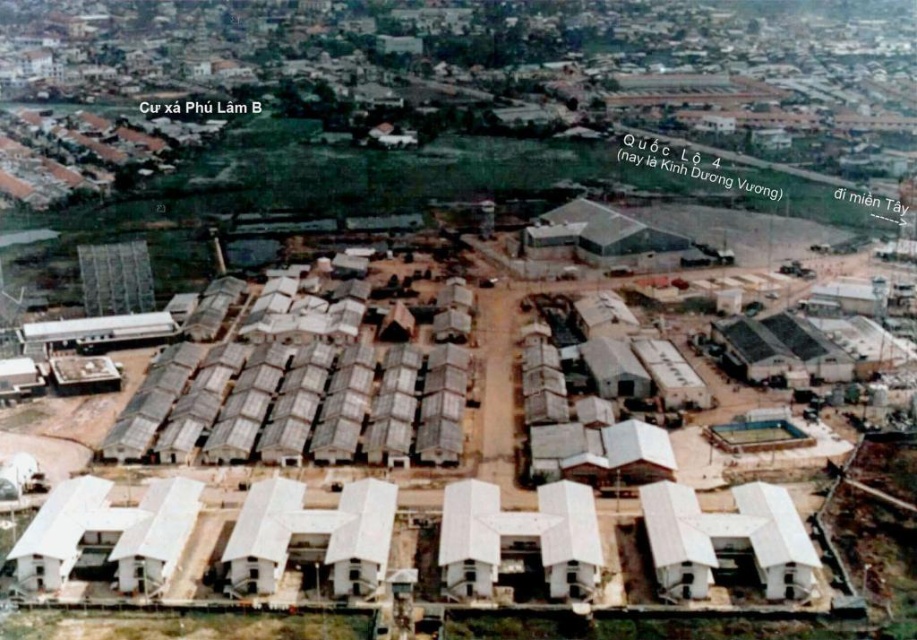
Is rustic wood hut at center closer to the viewer compared to white corrugated metal hut at lower right?

No, it is not.

Can you confirm if rustic wood hut at center is positioned below white corrugated metal hut at lower right?

No, rustic wood hut at center is not below white corrugated metal hut at lower right.

Does point (351, 387) lie behind point (663, 548)?

Yes, point (351, 387) is behind point (663, 548).

Locate an element on the screen. The image size is (917, 640). rustic wood hut at center is located at coordinates (286, 406).

Does point (398, 387) lie behind point (578, 211)?

That is False.

Can you confirm if rustic wood hut at center is wider than gray corrugated metal hut at center?

Yes, rustic wood hut at center is wider than gray corrugated metal hut at center.

Between point (182, 428) and point (597, 204), which one is positioned behind?

The point (597, 204) is more distant.

The image size is (917, 640). Identify the location of rustic wood hut at center. (286, 406).

Does white corrugated metal hut at lower right appear on the right side of gray corrugated metal hut at center?

Incorrect, white corrugated metal hut at lower right is not on the right side of gray corrugated metal hut at center.

Who is positioned more to the left, white corrugated metal hut at lower right or gray corrugated metal hut at center?

white corrugated metal hut at lower right

Where is `white corrugated metal hut at lower right`? This screenshot has width=917, height=640. white corrugated metal hut at lower right is located at coordinates (727, 540).